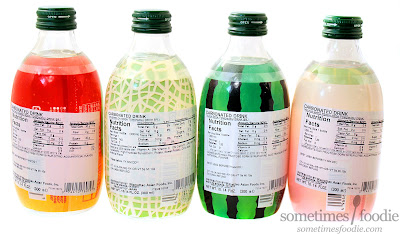
Locate an element on the screen. This screenshot has width=400, height=234. sticker is located at coordinates (66, 166), (168, 167), (260, 168), (354, 167).